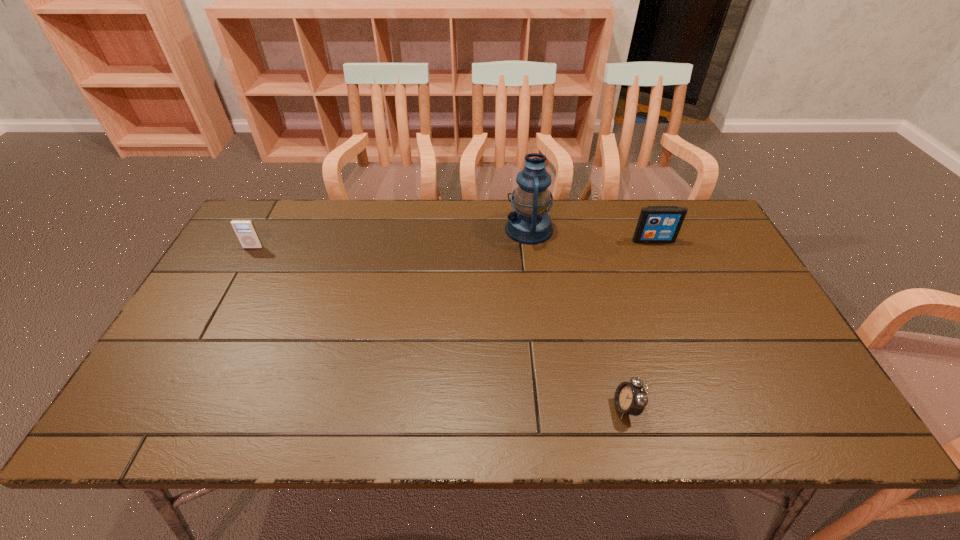
You are a GUI agent. You are given a task and a screenshot of the screen. Output one action in this format:
    pyautogui.click(x=<x>, y=<y>)
    Task: Click on the lantern
    
    Given the screenshot: What is the action you would take?
    pyautogui.click(x=529, y=223)

At what (x,y) coordinates should I click in order to perform the action: click on the tallest object. Please return your answer as a coordinate pair (x, y). This screenshot has width=960, height=540. Looking at the image, I should click on (529, 223).

Find the location of `the second tallest object`. the second tallest object is located at coordinates (657, 224).

You are a GUI agent. You are given a task and a screenshot of the screen. Output one action in this format:
    pyautogui.click(x=<x>, y=<y>)
    Task: Click on the farther iPod
    
    Given the screenshot: What is the action you would take?
    pyautogui.click(x=657, y=224)

Image resolution: width=960 pixels, height=540 pixels. What are the coordinates of `the leftmost object` in the screenshot? It's located at (245, 230).

Find the location of a particular element. the shorter iPod is located at coordinates (245, 230).

You are a GUI agent. You are given a task and a screenshot of the screen. Output one action in this format:
    pyautogui.click(x=<x>, y=<y>)
    Task: Click on the alarm clock
    This screenshot has height=540, width=960.
    Given the screenshot: What is the action you would take?
    pyautogui.click(x=630, y=398)

Locate an element on the screen. The width and height of the screenshot is (960, 540). the second object from right to left is located at coordinates (630, 398).

I want to click on vacant space located on the face of the lantern, so click(x=420, y=229).

In order to click on blank space located on the face of the lantern in this screenshot , I will do `click(455, 229)`.